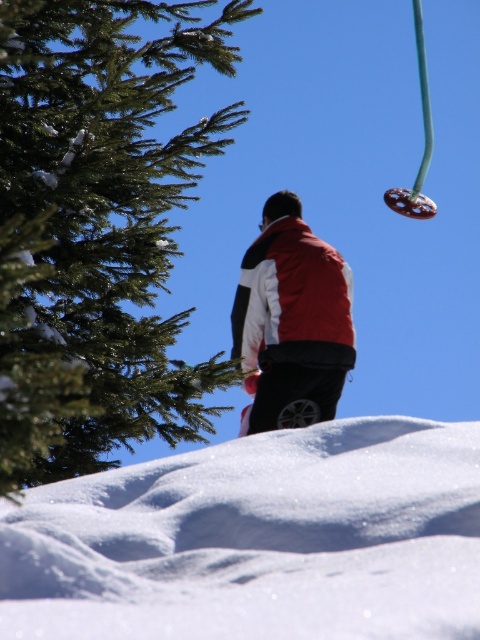
Question: Is white powdery snow at center to the left of matte red vest at center from the viewer's perspective?

Choices:
 (A) yes
 (B) no

Answer: (A)

Question: Which point is closer to the camera taking this photo?

Choices:
 (A) (334, 602)
 (B) (139, 397)

Answer: (A)

Question: Which object is farther from the camera taking this photo?

Choices:
 (A) matte red vest at center
 (B) green textured pine tree at left
 (C) white powdery snow at center

Answer: (A)

Question: Which of the following is the closest to the observer?

Choices:
 (A) (313, 372)
 (B) (412, 612)
 (C) (37, 122)

Answer: (B)

Question: Is white powdery snow at center smaller than green textured pine tree at left?

Choices:
 (A) no
 (B) yes

Answer: (B)

Question: Can you confirm if white powdery snow at center is smaller than green textured pine tree at left?

Choices:
 (A) yes
 (B) no

Answer: (A)